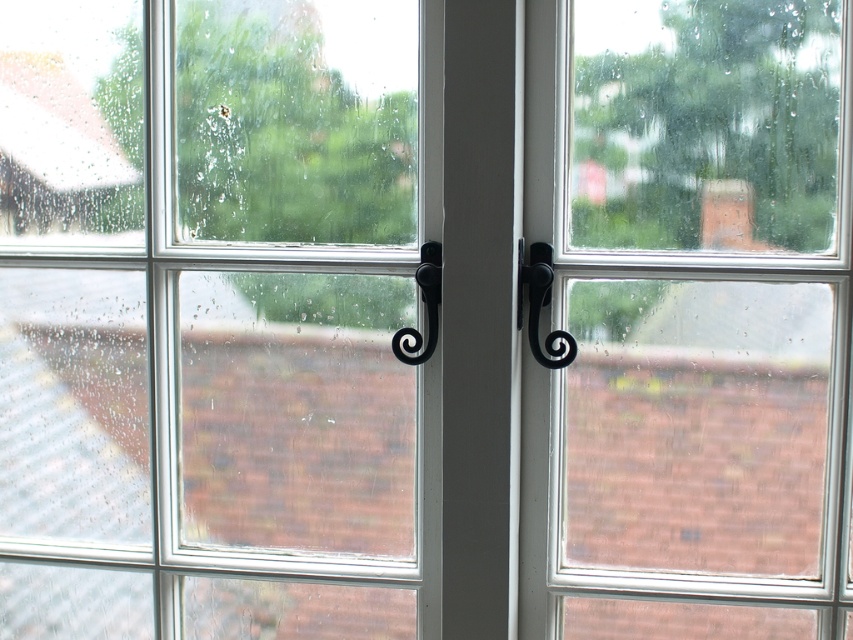
You are a delivery person trying to open the French doors shown in the image. You see a point at coordinate (541, 305). Is this point located on the black matte door handle at center right?

Yes, the point at coordinate (541, 305) is located on the black matte door handle at center right.

You are a window installer measuring the space between two clear glass windows. The standard spacing between windows in this design is 12 inches. Is the gap between the clear glass window at center and the clear glass window at right within the standard spacing requirement?

The distance between the clear glass window at center and the clear glass window at right is 12.14 inches, which is slightly over the standard 12 inches requirement. Therefore, the gap is just outside the standard spacing requirement.